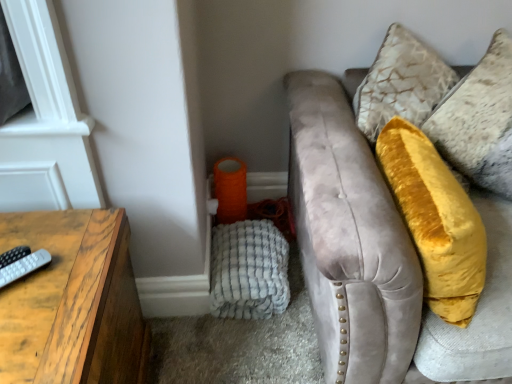
This screenshot has width=512, height=384. I want to click on free space in front of gray matte remote at left, so click(19, 338).